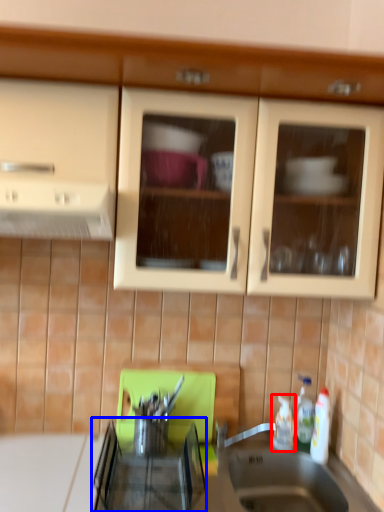
Question: Which of the following is the closest to the observer, bottle (highlighted by a red box) or appliance (highlighted by a blue box)?

Choices:
 (A) bottle
 (B) appliance

Answer: (B)